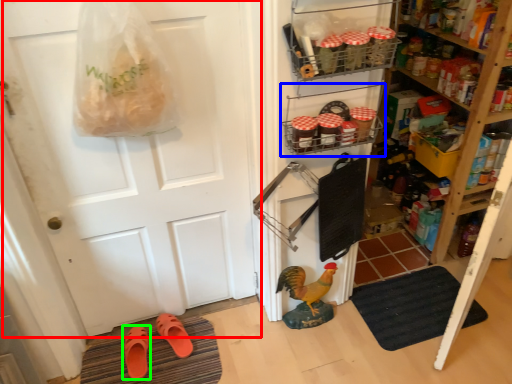
Question: Which object is the closest to the door (highlighted by a red box)? Choose among these: shelf (highlighted by a blue box) or footwear (highlighted by a green box).

Choices:
 (A) shelf
 (B) footwear

Answer: (A)